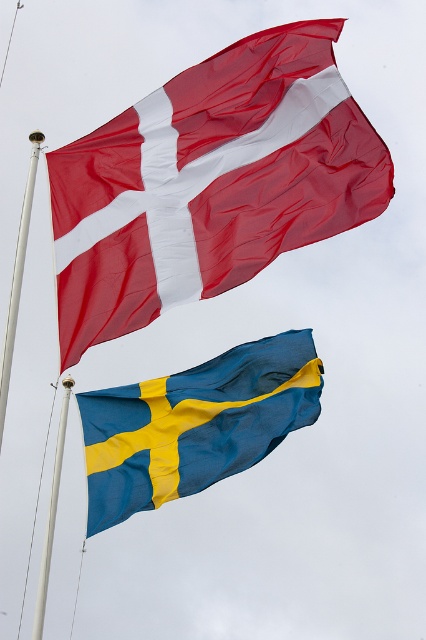
You are planning to hang a third flag between the matte red flag at upper center and the white metallic pole at upper left. The new flag requires a minimum of 10 feet of space to avoid tangling. Is there enough space between them?

The distance between the matte red flag at upper center and the white metallic pole at upper left is 33.67 feet, which is more than enough to accommodate the new flag requiring 10 feet of space without tangling.

You are standing in front of two flags. You see a matte red flag at upper center and a Swedish flag on the right. Which flag is closer to the left side of the scene?

The matte red flag at upper center is closer to the left side of the scene because it is positioned at point (210, 182), which is to the left of the Swedish flag on the right.